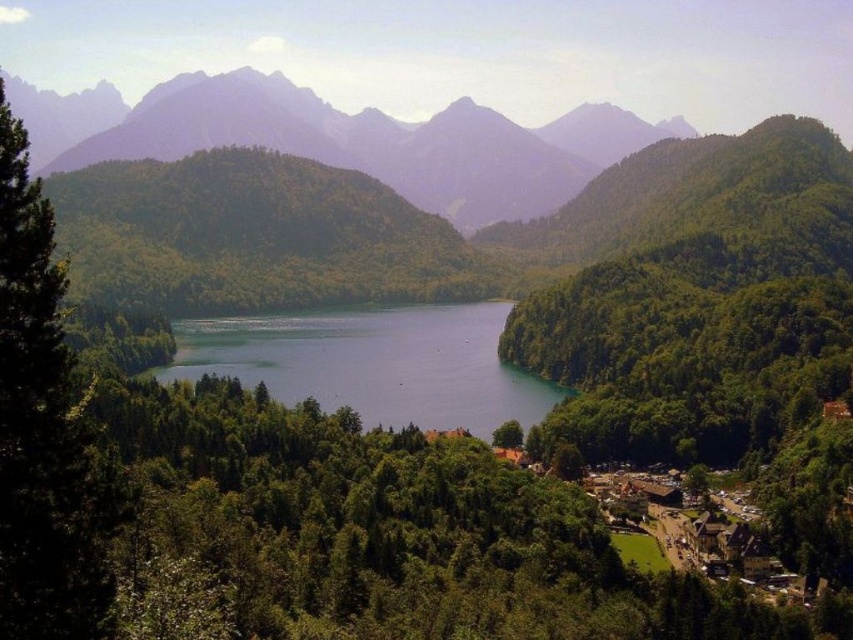
Can you confirm if green leafy tree at left is positioned to the right of green leafy tree at lower center?

Incorrect, green leafy tree at left is not on the right side of green leafy tree at lower center.

Is green leafy tree at left below green leafy tree at lower center?

No, green leafy tree at left is not below green leafy tree at lower center.

Does point (47, 438) come in front of point (502, 424)?

Yes, it is in front of point (502, 424).

Where is `green leafy tree at left`? This screenshot has width=853, height=640. green leafy tree at left is located at coordinates (44, 429).

Does rugged granite mountain at upper center have a lesser width compared to green water at center?

Incorrect, rugged granite mountain at upper center's width is not less than green water at center's.

Is rugged granite mountain at upper center smaller than green water at center?

No, rugged granite mountain at upper center is not smaller than green water at center.

Identify the location of rugged granite mountain at upper center. The height and width of the screenshot is (640, 853). point(346,140).

Can you confirm if green water at center is thinner than green leafy tree at lower center?

No.

Does green water at center have a greater width compared to green leafy tree at lower center?

Correct, the width of green water at center exceeds that of green leafy tree at lower center.

Between point (289, 400) and point (514, 444), which one is positioned behind?

Positioned behind is point (289, 400).

Locate an element on the screen. green water at center is located at coordinates (374, 364).